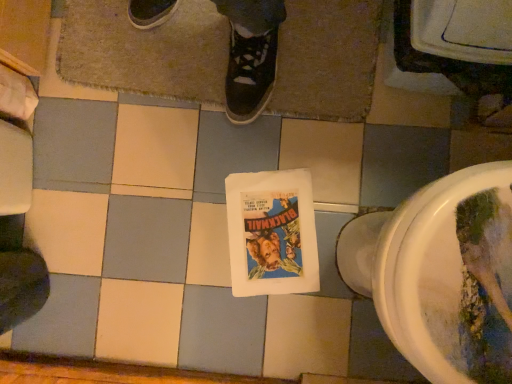
Question: Does matte paper comic book at center appear on the left side of brown textured bath mat at upper center?

Choices:
 (A) yes
 (B) no

Answer: (B)

Question: Is matte paper comic book at center further to the viewer compared to brown textured bath mat at upper center?

Choices:
 (A) yes
 (B) no

Answer: (A)

Question: Does matte paper comic book at center have a larger size compared to brown textured bath mat at upper center?

Choices:
 (A) yes
 (B) no

Answer: (B)

Question: Does matte paper comic book at center have a greater width compared to brown textured bath mat at upper center?

Choices:
 (A) no
 (B) yes

Answer: (A)

Question: Are matte paper comic book at center and brown textured bath mat at upper center located far from each other?

Choices:
 (A) yes
 (B) no

Answer: (B)

Question: Considering their positions, is matte paper comic book at center located in front of or behind brown textured bath mat at upper center?

Choices:
 (A) behind
 (B) front

Answer: (A)

Question: Considering the relative positions of matte paper comic book at center and brown textured bath mat at upper center in the image provided, is matte paper comic book at center to the left or to the right of brown textured bath mat at upper center?

Choices:
 (A) left
 (B) right

Answer: (B)

Question: From the image's perspective, is matte paper comic book at center located above or below brown textured bath mat at upper center?

Choices:
 (A) below
 (B) above

Answer: (A)

Question: Is matte paper comic book at center inside the boundaries of brown textured bath mat at upper center, or outside?

Choices:
 (A) inside
 (B) outside

Answer: (B)

Question: From the image's perspective, is white glossy toilet at lower right positioned above or below matte paper comic book at center?

Choices:
 (A) above
 (B) below

Answer: (A)

Question: Considering the positions of white glossy toilet at lower right and matte paper comic book at center in the image, is white glossy toilet at lower right bigger or smaller than matte paper comic book at center?

Choices:
 (A) small
 (B) big

Answer: (B)

Question: Is white glossy toilet at lower right inside the boundaries of matte paper comic book at center, or outside?

Choices:
 (A) outside
 (B) inside

Answer: (A)

Question: Is point (465, 288) closer or farther from the camera than point (251, 281)?

Choices:
 (A) farther
 (B) closer

Answer: (B)

Question: From the image's perspective, is brown textured bath mat at upper center positioned above or below white glossy toilet at lower right?

Choices:
 (A) above
 (B) below

Answer: (A)

Question: Does point (193, 41) appear closer or farther from the camera than point (484, 223)?

Choices:
 (A) farther
 (B) closer

Answer: (A)